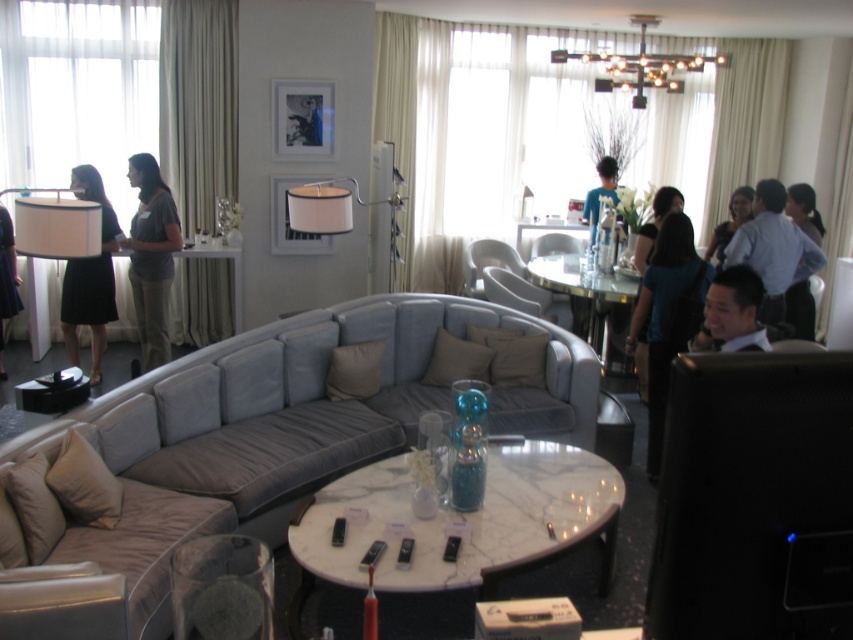
You are planning to replace the beige fabric curtain at upper right with a new one that is exactly the same size. You have a curtain that is the same width as the suede armchair at center. Will this new curtain be wide enough to cover the existing one?

The beige fabric curtain at upper right is wider than the suede armchair at center. Therefore, the new curtain, which matches the armchair in width, will not be wide enough to cover the existing curtain.

You are a guest entering the lounge and want to find a place to sit. You notice the beige fabric curtain at upper right and the suede armchair at center. Which object is taller?

The beige fabric curtain at upper right is taller than the suede armchair at center.